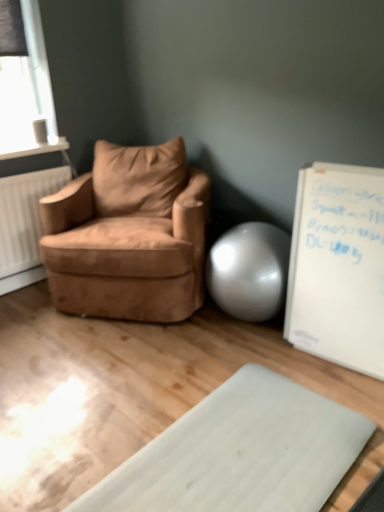
This screenshot has width=384, height=512. What do you see at coordinates (129, 234) in the screenshot?
I see `suede brown armchair at left` at bounding box center [129, 234].

The width and height of the screenshot is (384, 512). In order to click on suede brown armchair at left in this screenshot , I will do `click(129, 234)`.

The height and width of the screenshot is (512, 384). Identify the location of suede brown armchair at left. (129, 234).